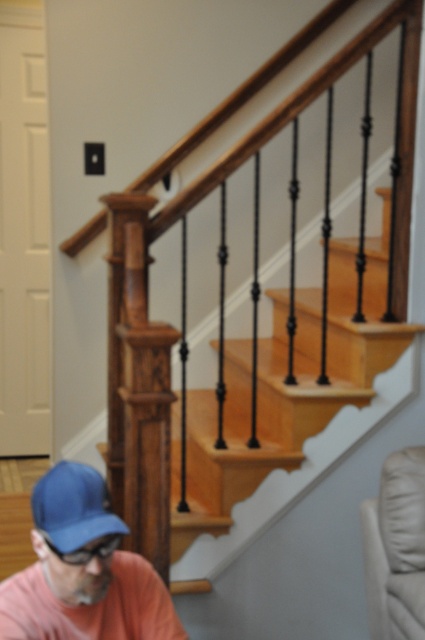
Can you confirm if wooden stairs at upper center is wider than blue fabric baseball cap at lower left?

Correct, the width of wooden stairs at upper center exceeds that of blue fabric baseball cap at lower left.

Who is shorter, wooden stairs at upper center or blue fabric baseball cap at lower left?

blue fabric baseball cap at lower left is shorter.

The image size is (425, 640). Identify the location of wooden stairs at upper center. (226, 396).

Locate an element on the screen. wooden stairs at upper center is located at coordinates (226, 396).

Does wooden stairs at upper center have a smaller size compared to matte black goggles at lower left?

Actually, wooden stairs at upper center might be larger than matte black goggles at lower left.

Locate an element on the screen. Image resolution: width=425 pixels, height=640 pixels. wooden stairs at upper center is located at coordinates (226, 396).

Does wooden stairs at upper center have a greater width compared to blue fabric cap at lower left?

Yes, wooden stairs at upper center is wider than blue fabric cap at lower left.

Is wooden stairs at upper center taller than blue fabric cap at lower left?

Indeed, wooden stairs at upper center has a greater height compared to blue fabric cap at lower left.

You are a GUI agent. You are given a task and a screenshot of the screen. Output one action in this format:
    pyautogui.click(x=<x>, y=<y>)
    Task: Click on the wooden stairs at upper center
    This screenshot has width=425, height=640.
    Given the screenshot: What is the action you would take?
    pyautogui.click(x=226, y=396)

Locate an element on the screen. wooden stairs at upper center is located at coordinates (226, 396).